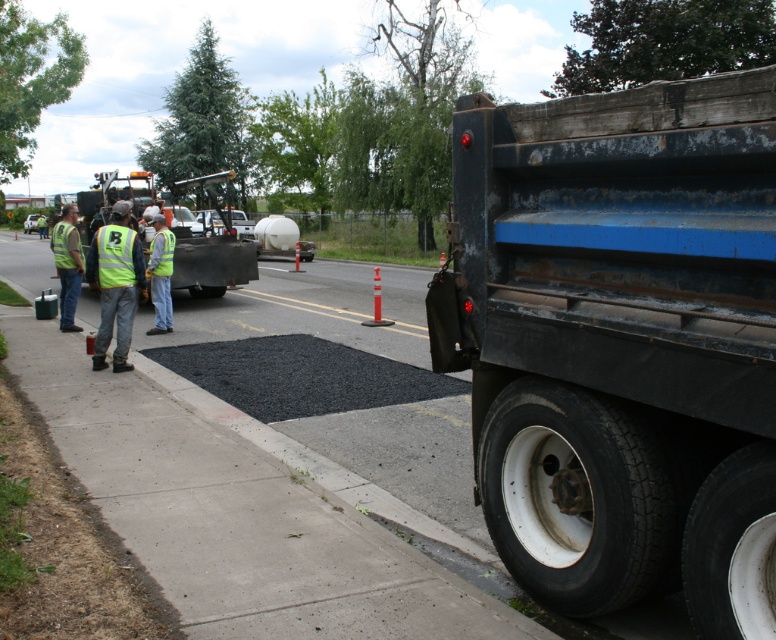
From the picture: Is black asphalt at center below yellow reflective vest at center?

Yes.

Between black asphalt at center and yellow reflective vest at center, which one is positioned lower?

black asphalt at center

Which is in front, point (279, 520) or point (165, 257)?

Point (279, 520)

At what (x,y) coordinates should I click in order to perform the action: click on black asphalt at center. Please return your answer as a coordinate pair (x, y). Looking at the image, I should click on (241, 508).

Is rusty metal trailer truck at right to the right of black asphalt spreader at center from the viewer's perspective?

Indeed, rusty metal trailer truck at right is positioned on the right side of black asphalt spreader at center.

What do you see at coordinates (619, 340) in the screenshot?
I see `rusty metal trailer truck at right` at bounding box center [619, 340].

Which is in front, point (584, 388) or point (184, 250)?

Positioned in front is point (584, 388).

The width and height of the screenshot is (776, 640). Find the location of `rusty metal trailer truck at right`. rusty metal trailer truck at right is located at coordinates (619, 340).

Does black asphalt spreader at center have a greater height compared to yellow reflective vest at center?

Correct, black asphalt spreader at center is much taller as yellow reflective vest at center.

Who is shorter, black asphalt spreader at center or yellow reflective vest at center?

Standing shorter between the two is yellow reflective vest at center.

Which is behind, point (217, 296) or point (165, 264)?

Positioned behind is point (217, 296).

The height and width of the screenshot is (640, 776). I want to click on black asphalt spreader at center, so click(x=210, y=243).